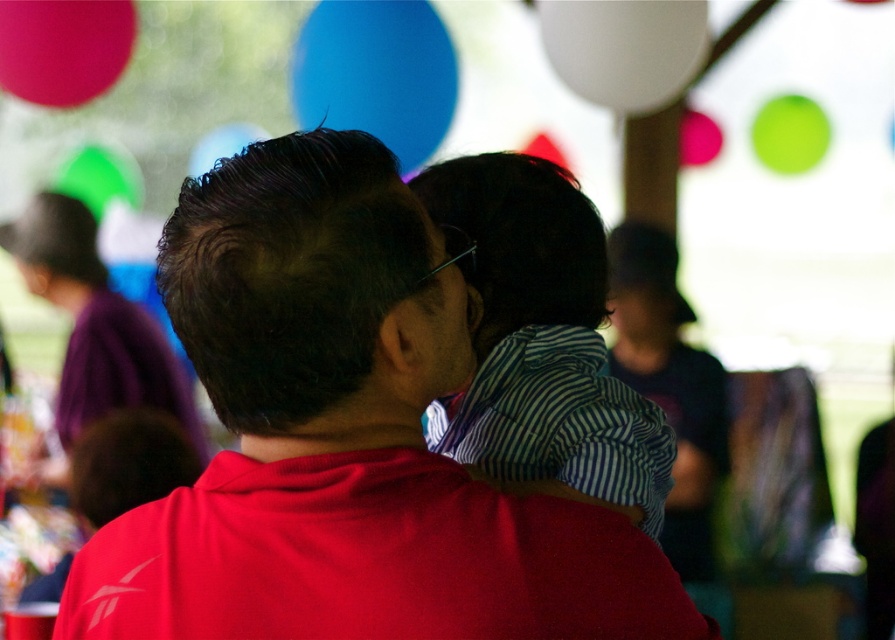
Between purple fabric at upper left and white matte balloon at upper center, which one has more height?

purple fabric at upper left

Between point (47, 232) and point (601, 52), which one is positioned behind?

The point (47, 232) is more distant.

Identify the location of purple fabric at upper left. This screenshot has height=640, width=895. (97, 324).

Who is more distant from viewer, (x=441, y=461) or (x=704, y=35)?

The point (x=704, y=35) is more distant.

Who is more distant from viewer, (290, 291) or (692, 51)?

The point (692, 51) is behind.

I want to click on matte red shirt at center, so click(344, 440).

Is blue glossy balloon at upper center taller than white matte balloon at upper center?

Yes.

Consider the image. Between blue glossy balloon at upper center and white matte balloon at upper center, which one is positioned higher?

blue glossy balloon at upper center

Does point (442, 65) come farther from viewer compared to point (578, 29)?

Yes, it is behind point (578, 29).

This screenshot has width=895, height=640. I want to click on blue glossy balloon at upper center, so click(377, 74).